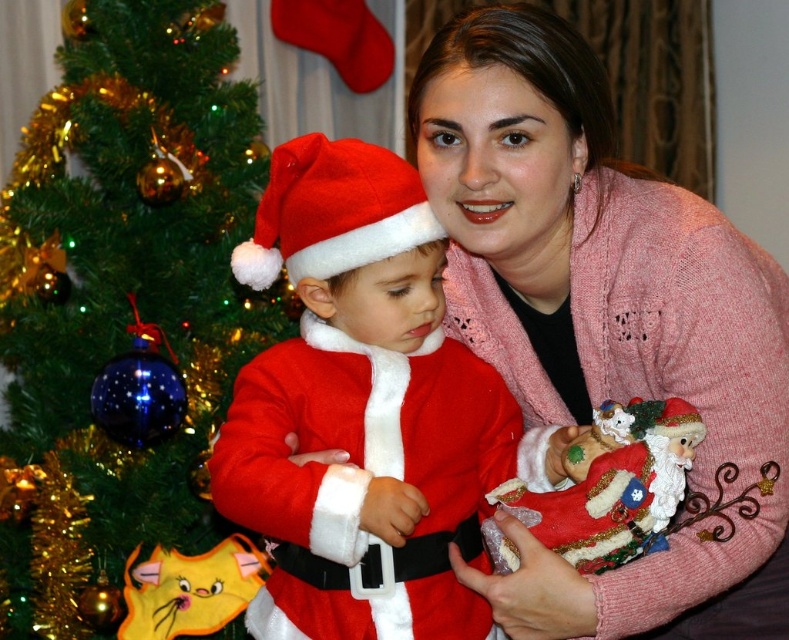
Does point (492, 609) lie in front of point (109, 465)?

That is True.

Is pink knitted sweater at center to the left of green textured christmas tree at left from the viewer's perspective?

In fact, pink knitted sweater at center is to the right of green textured christmas tree at left.

Locate an element on the screen. The height and width of the screenshot is (640, 789). pink knitted sweater at center is located at coordinates (606, 323).

Can you confirm if green textured christmas tree at left is smaller than velvet red santa at center?

No.

Is green textured christmas tree at left below velvet red santa at center?

Actually, green textured christmas tree at left is above velvet red santa at center.

What do you see at coordinates (122, 307) in the screenshot?
I see `green textured christmas tree at left` at bounding box center [122, 307].

Locate an element on the screen. green textured christmas tree at left is located at coordinates (122, 307).

Which is behind, point (526, 486) or point (432, 234)?

The point (432, 234) is behind.

Measure the distance between point [509,499] and camera.

A distance of 1.08 meters exists between point [509,499] and camera.

Who is more distant from viewer, (x=660, y=460) or (x=238, y=276)?

Point (x=238, y=276)

Find the location of `velvet red santa at center`. velvet red santa at center is located at coordinates (612, 484).